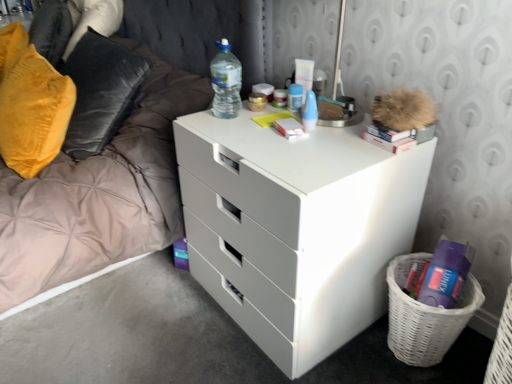
Question: Considering the positions of velvet yellow pillow at left and white wicker basket at lower right in the image, is velvet yellow pillow at left wider or thinner than white wicker basket at lower right?

Choices:
 (A) thin
 (B) wide

Answer: (A)

Question: Considering their positions, is velvet yellow pillow at left located in front of or behind white wicker basket at lower right?

Choices:
 (A) behind
 (B) front

Answer: (A)

Question: Estimate the real-world distances between objects in this image. Which object is farther from the white matte book at center, which ranks as the second book in right-to-left order?

Choices:
 (A) translucent plastic water bottle at upper center
 (B) white glossy bed frame at left
 (C) white matte chest of drawers at center
 (D) white wicker basket at lower right
 (E) hardcover book at upper right, arranged as the second book when viewed from the left

Answer: (B)

Question: Estimate the real-world distances between objects in this image. Which object is closer to the white plastic tube at upper center, positioned as the 1th toiletry in back-to-front order?

Choices:
 (A) hardcover book at upper right, arranged as the second book when viewed from the left
 (B) velvet yellow pillow at left
 (C) translucent plastic water bottle at upper center
 (D) white glossy bed frame at left
 (E) white matte book at center, which ranks as the 1th book in left-to-right order

Answer: (E)